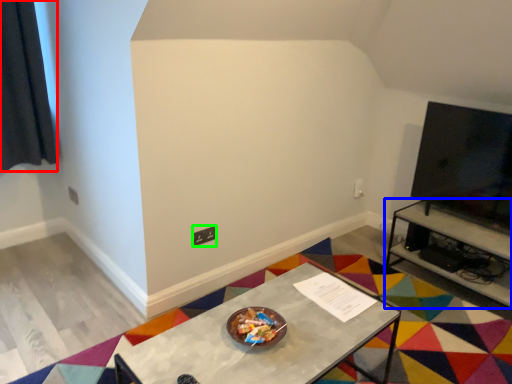
Question: Based on their relative distances, which object is farther from curtain (highlighted by a red box)? Choose from table (highlighted by a blue box) and square (highlighted by a green box).

Choices:
 (A) table
 (B) square

Answer: (A)